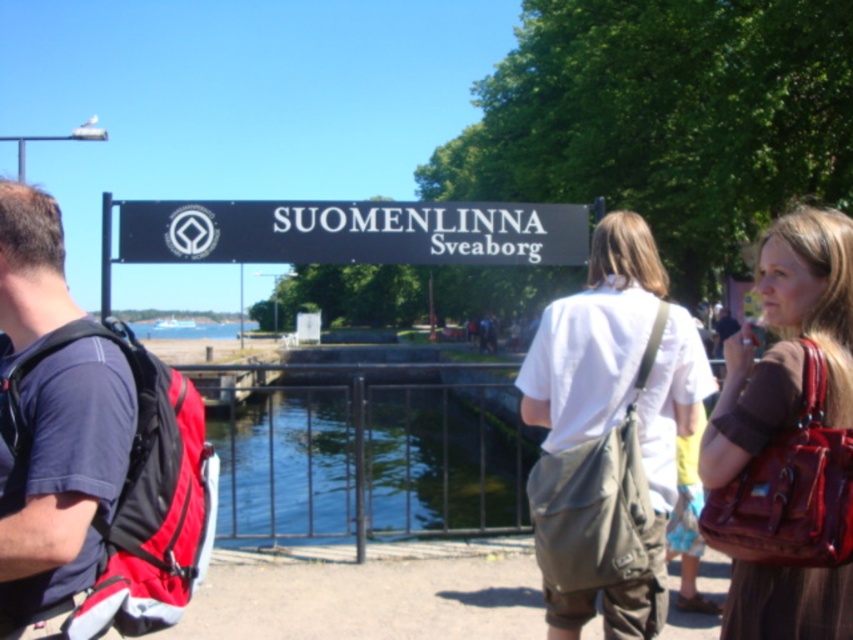
You are a photographer trying to capture both the dark blue fabric shirt at left and the white cotton shirt at center in the same frame. Which person should you focus on first to ensure both are in the shot?

You should focus on the dark blue fabric shirt at left first because it is larger in size than the white cotton shirt at center, allowing you to frame both effectively.

You are a tourist at Suomenlinna Sveaborg and notice two items in the scene. One is a brown shiny handbag at center right and the other is a black plastic sign at center. Which item is taller?

The brown shiny handbag at center right is taller than the black plastic sign at center.